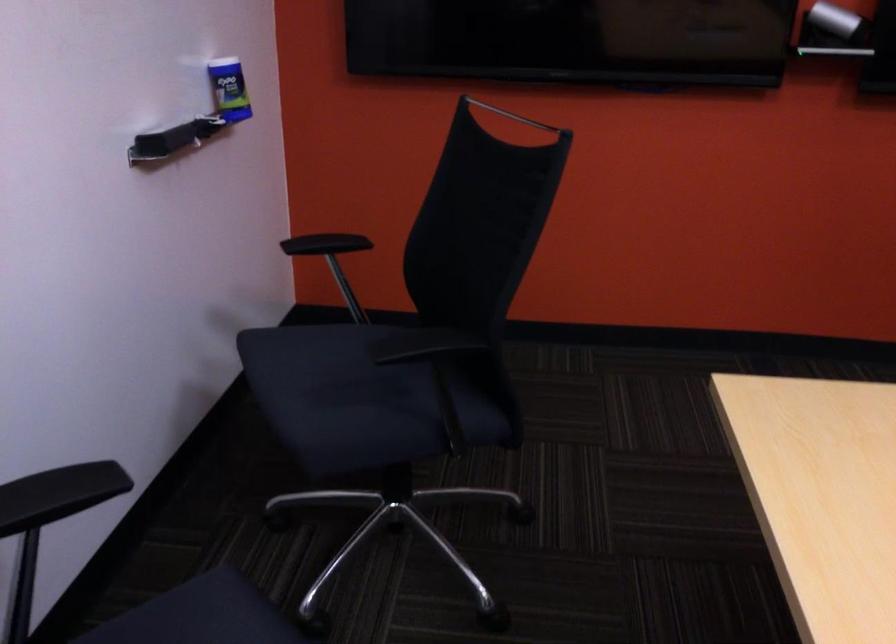
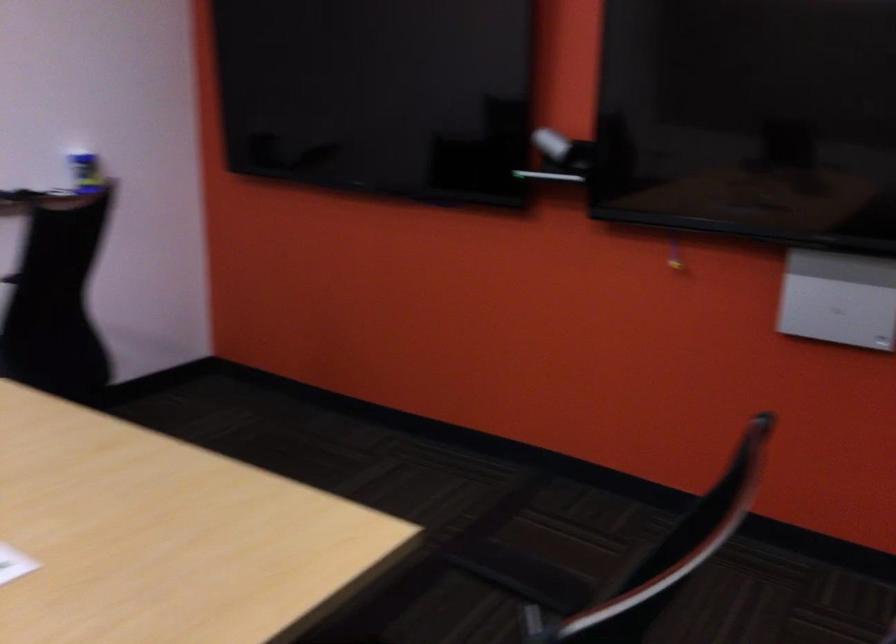
Question: What movement of the cameraman would produce the second image?

Choices:
 (A) Left
 (B) Right
 (C) Forward
 (D) Backward

Answer: (B)